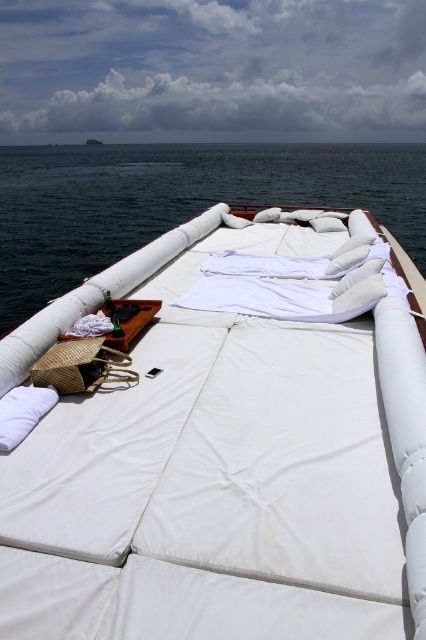
Question: Considering the relative positions of white fabric bed at center and dark blue water at center in the image provided, where is white fabric bed at center located with respect to dark blue water at center?

Choices:
 (A) right
 (B) left

Answer: (B)

Question: In this image, where is white fabric bed at center located relative to dark blue water at center?

Choices:
 (A) below
 (B) above

Answer: (A)

Question: Can you confirm if white fabric bed at center is bigger than dark blue water at center?

Choices:
 (A) yes
 (B) no

Answer: (B)

Question: Which of the following is the closest to the observer?

Choices:
 (A) (241, 630)
 (B) (101, 228)

Answer: (A)

Question: Which of the following is the closest to the observer?

Choices:
 (A) dark blue water at center
 (B) white fabric bed at center

Answer: (B)